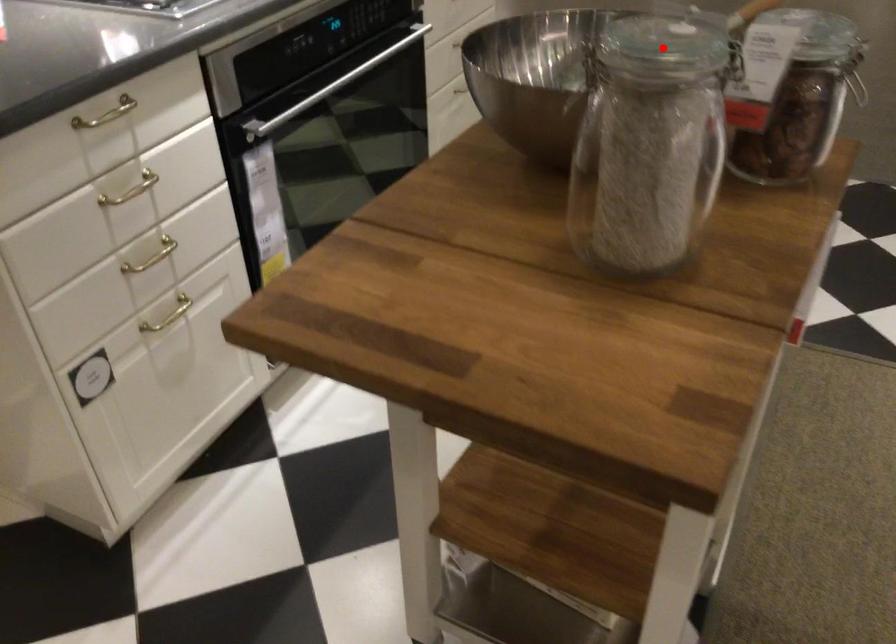
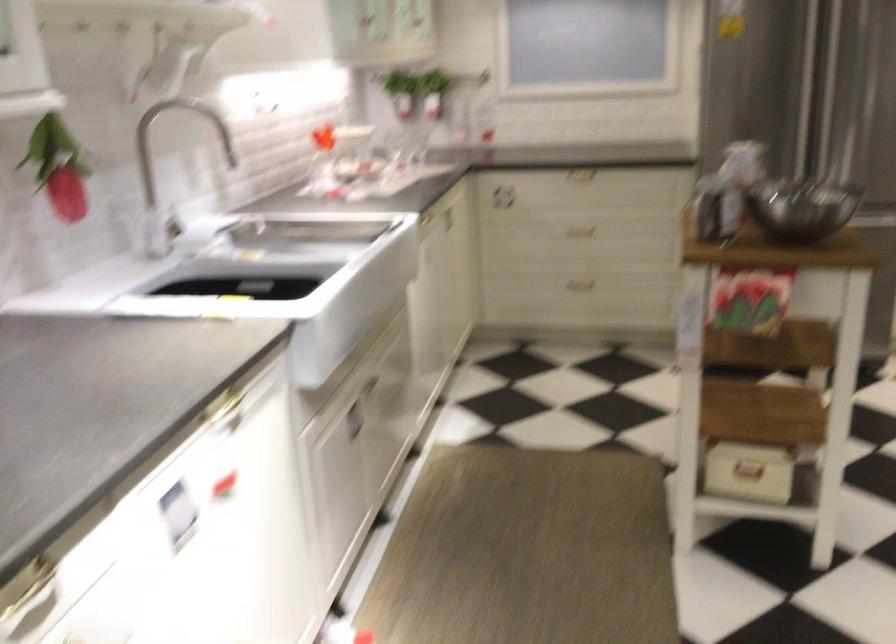
The point at the highlighted location is marked in the first image. Where is the corresponding point in the second image?

(729, 138)